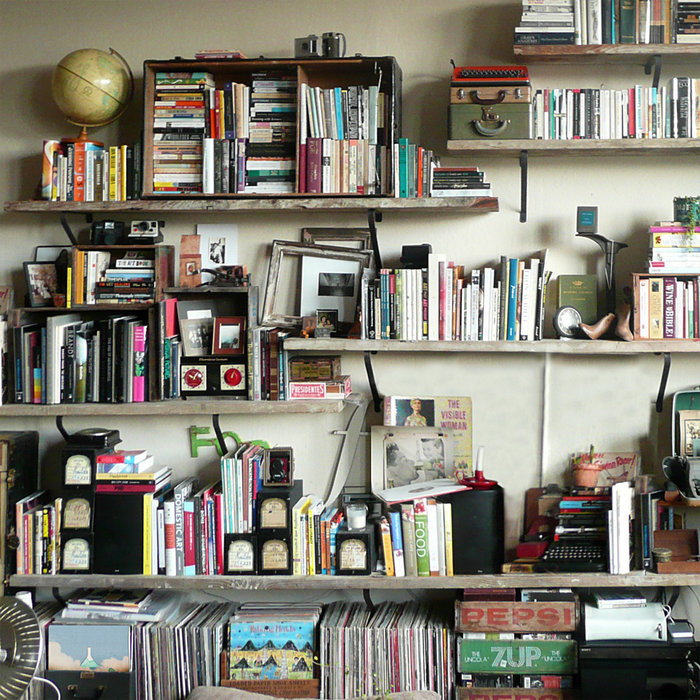
In order to click on typewriters and typewriter cases in this screenshot , I will do `click(503, 78)`, `click(516, 99)`, `click(508, 127)`, `click(582, 554)`.